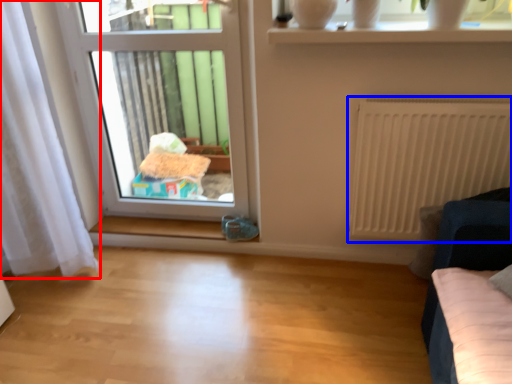
Question: Among these objects, which one is farthest to the camera, curtain (highlighted by a red box) or radiator (highlighted by a blue box)?

Choices:
 (A) curtain
 (B) radiator

Answer: (B)